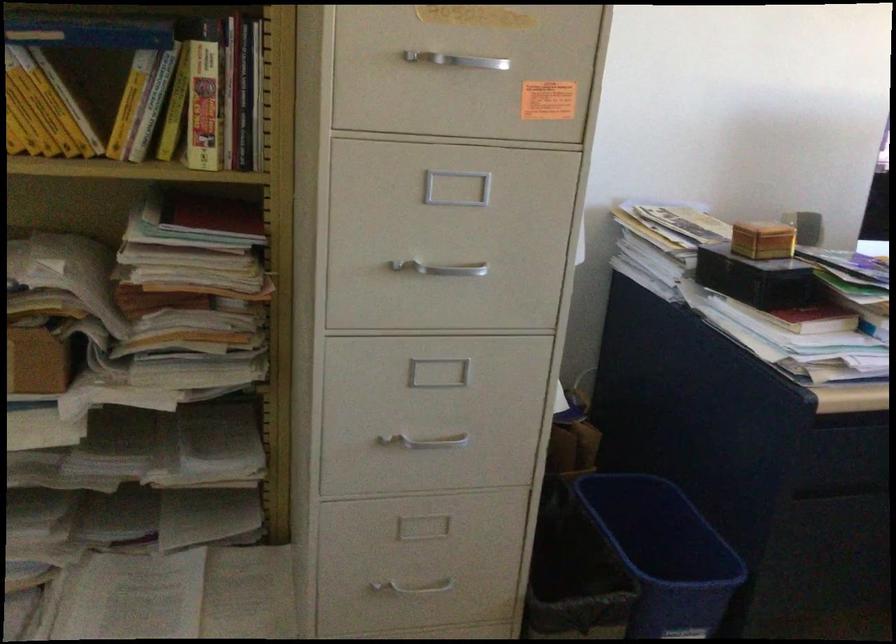
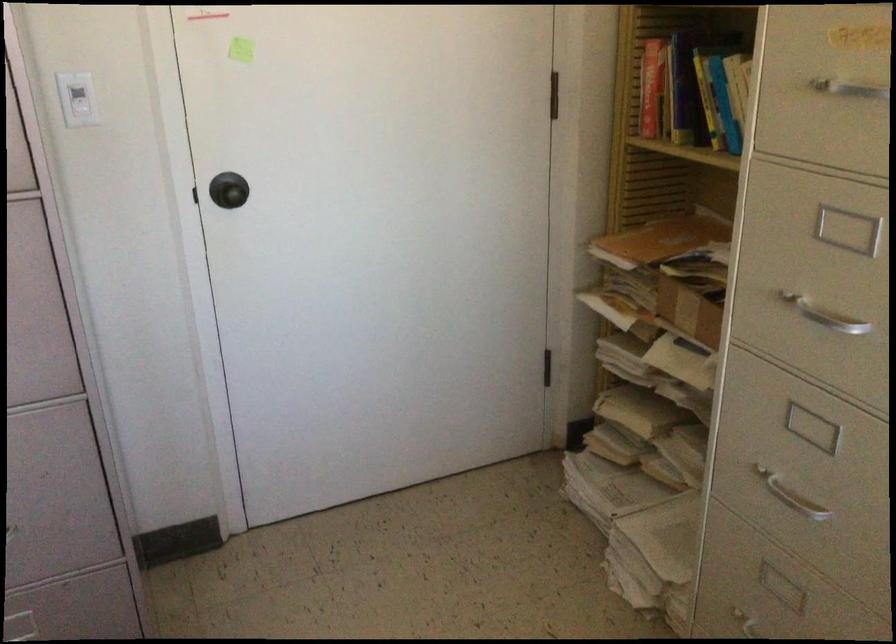
Locate, in the second image, the point that corresponds to the point at 428,431 in the first image.

(790, 496)